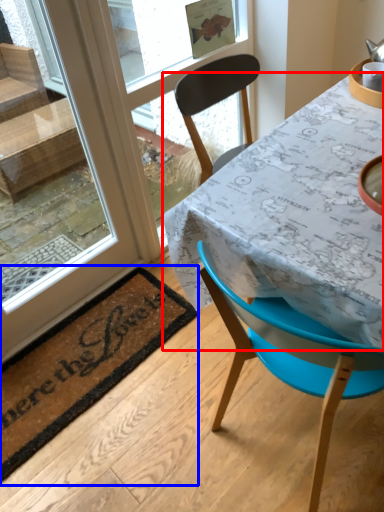
Question: Which object appears farthest to the camera in this image, table (highlighted by a red box) or mat (highlighted by a blue box)?

Choices:
 (A) table
 (B) mat

Answer: (B)